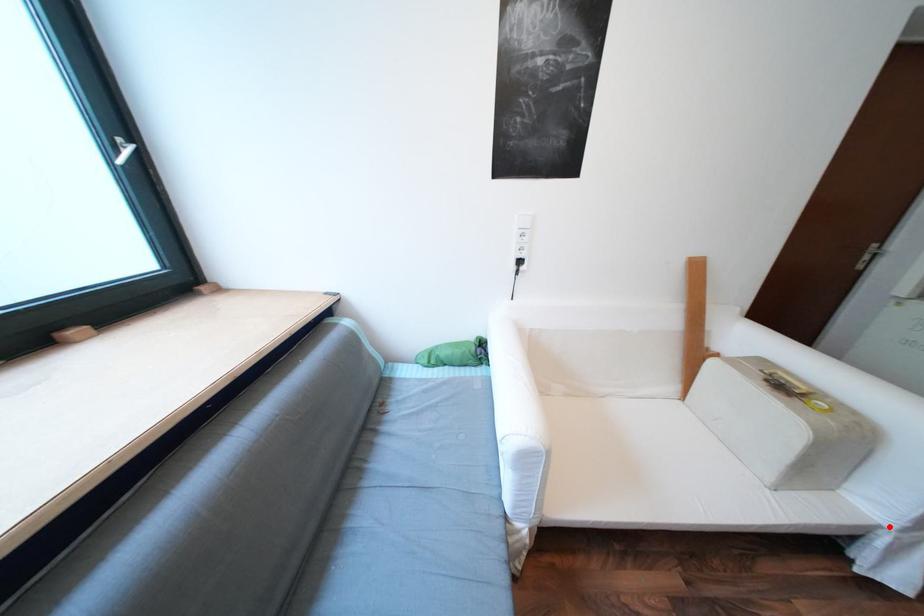
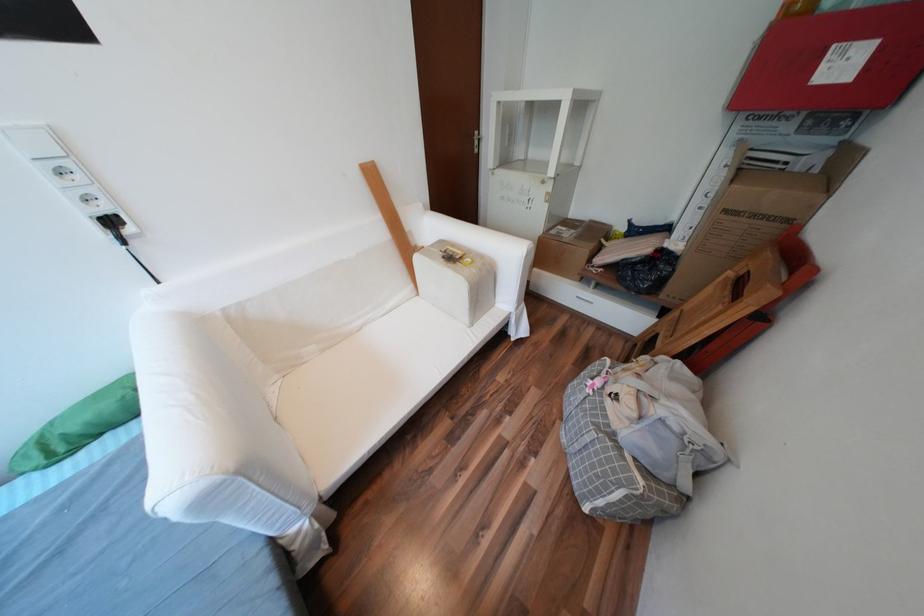
Question: I am providing you with two images of the same scene from different viewpoints. A red point is marked on the first image. Can you still see the location of the red point in image 2?

Choices:
 (A) Yes
 (B) No

Answer: (A)